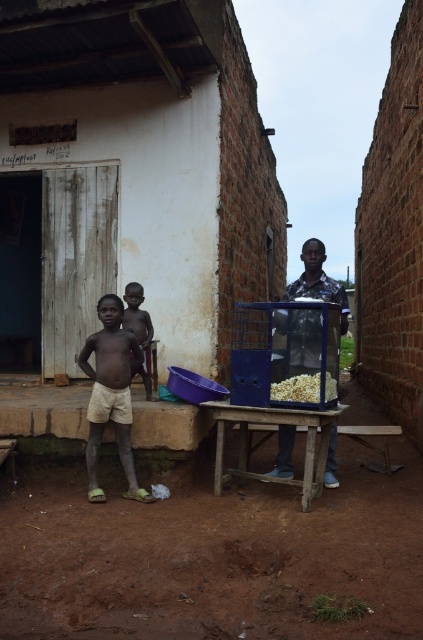
You are a customer at a popcorn stand and want to grab your popcorn without getting too close to the person behind the counter. The recommended social distance is 6 feet. Can you reach the white popcorn at center from your position at the light beige shorts at center without violating the distance?

The distance between light beige shorts at center and white popcorn at center is 4.40 feet, which is less than the recommended 6 feet social distance. Therefore, reaching the white popcorn at center from light beige shorts at center would require moving closer than 6 feet.

In the scene shown: You are a customer at a popcorn stand and see the light beige shorts at center and the white popcorn at center. Which item is closer to the left side of the stand?

The light beige shorts at center is to the left of white popcorn at center, so the light beige shorts at center is closer to the left side of the stand.

You are standing at the entrance of the scene and want to buy popcorn. Where is the metallic popcorn machine at center located relative to the entrance?

The metallic popcorn machine at center is located at point (x=315, y=276) relative to the entrance, which means it is positioned to the right and slightly forward from your current position at the entrance.